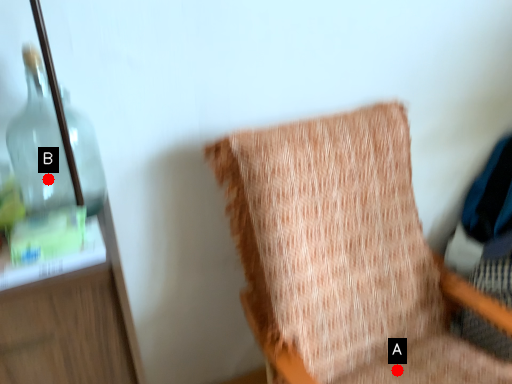
Question: Two points are circled on the image, labeled by A and B beside each circle. Which of the following is the closest to the observer?

Choices:
 (A) A is closer
 (B) B is closer

Answer: (B)